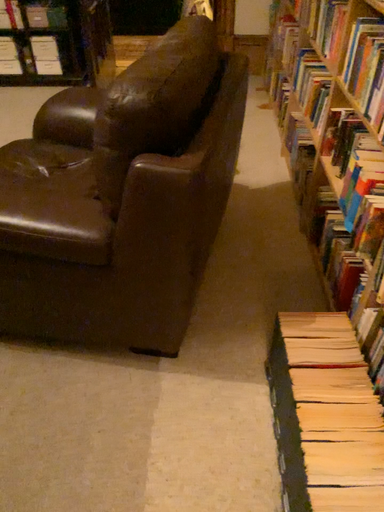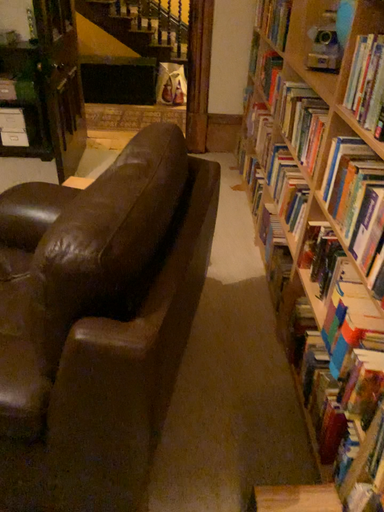
Question: How did the camera likely rotate when shooting the video?

Choices:
 (A) rotated upward
 (B) rotated downward

Answer: (A)